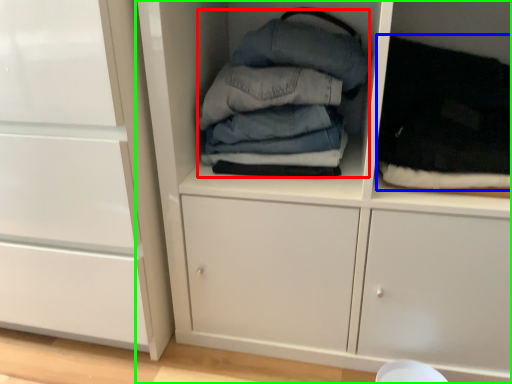
Question: Which is nearer to the clothing (highlighted by a red box)? clothing (highlighted by a blue box) or cupboard (highlighted by a green box).

Choices:
 (A) clothing
 (B) cupboard

Answer: (B)